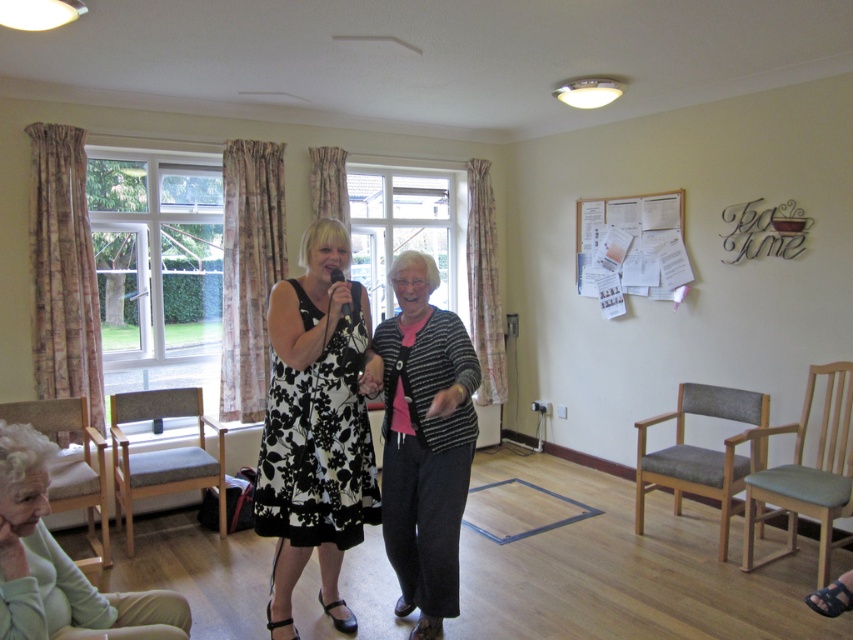
You are an event organizer checking the setup for an upcoming performance. You notice two chairs in the lower left corner of the stage area. The chairs are labeled as light green fabric chair at lower left and light beige fabric armchair at lower left. Which chair is placed in front of the other?

The light green fabric chair at lower left is positioned over light beige fabric armchair at lower left, meaning the light green fabric chair is in front of the light beige fabric armchair.

You are an event photographer standing in the back of the room. You want to capture a photo that includes both the light beige fabric armchair at lower left and the black matte microphone at center. Based on their positions, will the microphone be above or below the armchair in the photo?

The light beige fabric armchair at lower left is below the black matte microphone at center, so in the photo, the microphone will be above the armchair.

In the scene shown: You are standing in the front row of the audience facing the two performers. There are two points marked on the stage floor in front of the performers. One is at coordinate point (152,636) and the other is at point (86,458). Which point is closer to you?

The point at coordinate (152,636) is closer to you because it is closer to the camera than point (86,458).